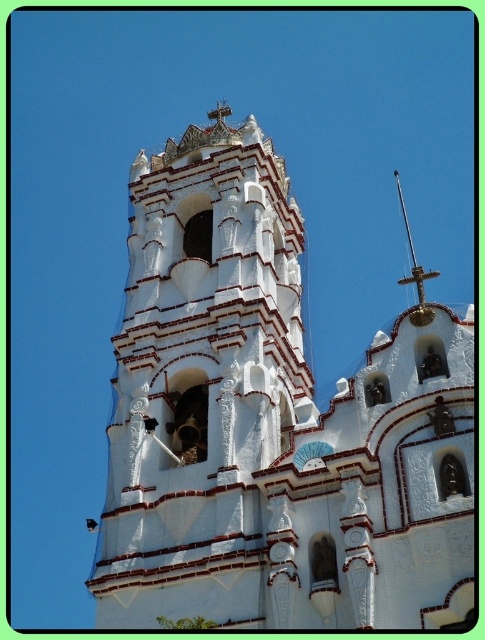
Question: Which point is farther from the camera taking this photo?

Choices:
 (A) (215, 198)
 (B) (420, 304)

Answer: (B)

Question: Where is white stucco church at center located in relation to polished brass spire at upper right in the image?

Choices:
 (A) right
 (B) left

Answer: (B)

Question: Does white stucco church at center appear under polished brass spire at upper right?

Choices:
 (A) no
 (B) yes

Answer: (B)

Question: Can you confirm if white stucco church at center is positioned to the right of polished brass spire at upper right?

Choices:
 (A) no
 (B) yes

Answer: (A)